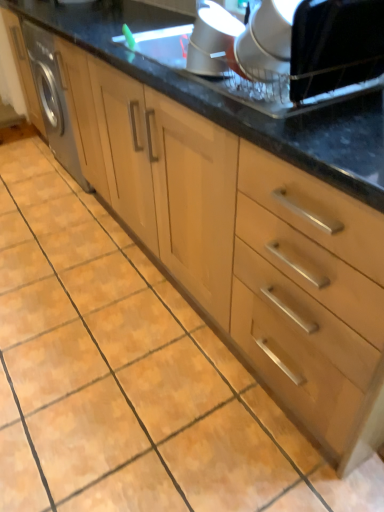
Question: Is satin silver vent at upper center, which is the 1th appliance in left-to-right order, to the left of black fabric at upper right, the 2th appliance viewed from the left, from the viewer's perspective?

Choices:
 (A) yes
 (B) no

Answer: (A)

Question: From a real-world perspective, is satin silver vent at upper center, the second appliance from the right, positioned under black fabric at upper right, the 2th appliance viewed from the left, based on gravity?

Choices:
 (A) no
 (B) yes

Answer: (B)

Question: Is satin silver vent at upper center, the second appliance from the right, directly adjacent to black fabric at upper right, which appears as the 1th appliance when viewed from the right?

Choices:
 (A) yes
 (B) no

Answer: (B)

Question: Would you say black fabric at upper right, the 2th appliance viewed from the left, is part of satin silver vent at upper center, which is the 1th appliance in left-to-right order,'s contents?

Choices:
 (A) no
 (B) yes

Answer: (A)

Question: Can you confirm if satin silver vent at upper center, which is the 1th appliance in left-to-right order, is smaller than black fabric at upper right, the 2th appliance viewed from the left?

Choices:
 (A) yes
 (B) no

Answer: (A)

Question: Considering the relative sizes of satin silver vent at upper center, the second appliance from the right, and black fabric at upper right, which appears as the 1th appliance when viewed from the right, in the image provided, is satin silver vent at upper center, the second appliance from the right, shorter than black fabric at upper right, which appears as the 1th appliance when viewed from the right,?

Choices:
 (A) no
 (B) yes

Answer: (B)

Question: From the image's perspective, is black fabric at upper right, the 2th appliance viewed from the left, over satin silver vent at upper center, the second appliance from the right?

Choices:
 (A) yes
 (B) no

Answer: (B)

Question: Is black fabric at upper right, which appears as the 1th appliance when viewed from the right, to the right of satin silver vent at upper center, the second appliance from the right, from the viewer's perspective?

Choices:
 (A) yes
 (B) no

Answer: (A)

Question: Is black fabric at upper right, the 2th appliance viewed from the left, shorter than satin silver vent at upper center, the second appliance from the right?

Choices:
 (A) no
 (B) yes

Answer: (A)

Question: Is black fabric at upper right, which appears as the 1th appliance when viewed from the right, in contact with satin silver vent at upper center, which is the 1th appliance in left-to-right order?

Choices:
 (A) yes
 (B) no

Answer: (B)

Question: Does black fabric at upper right, which appears as the 1th appliance when viewed from the right, come behind satin silver vent at upper center, which is the 1th appliance in left-to-right order?

Choices:
 (A) no
 (B) yes

Answer: (A)

Question: Considering the relative sizes of black fabric at upper right, the 2th appliance viewed from the left, and satin silver vent at upper center, which is the 1th appliance in left-to-right order, in the image provided, is black fabric at upper right, the 2th appliance viewed from the left, taller than satin silver vent at upper center, which is the 1th appliance in left-to-right order,?

Choices:
 (A) yes
 (B) no

Answer: (A)

Question: Relative to satin silver vent at upper center, which is the 1th appliance in left-to-right order, is black fabric at upper right, the 2th appliance viewed from the left, in front or behind?

Choices:
 (A) front
 (B) behind

Answer: (A)